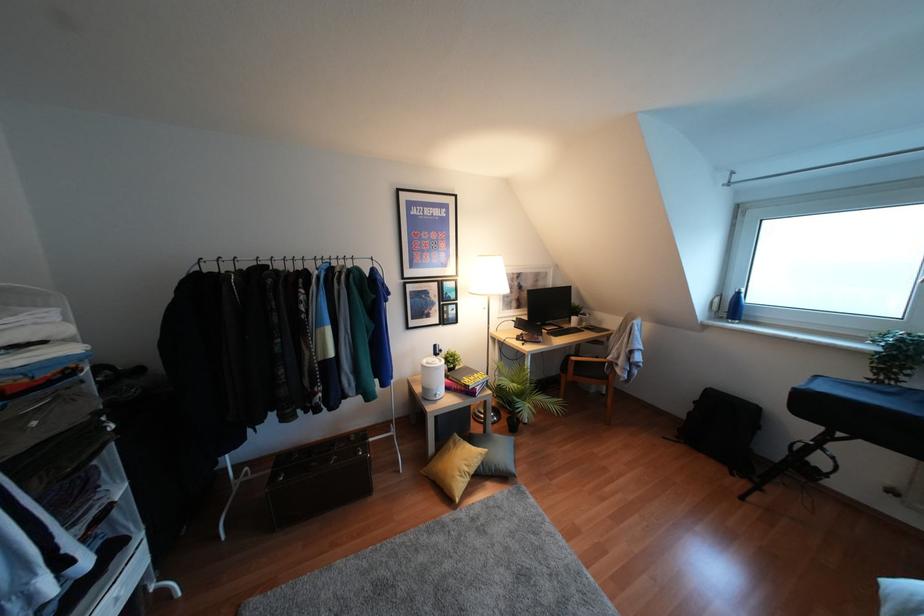
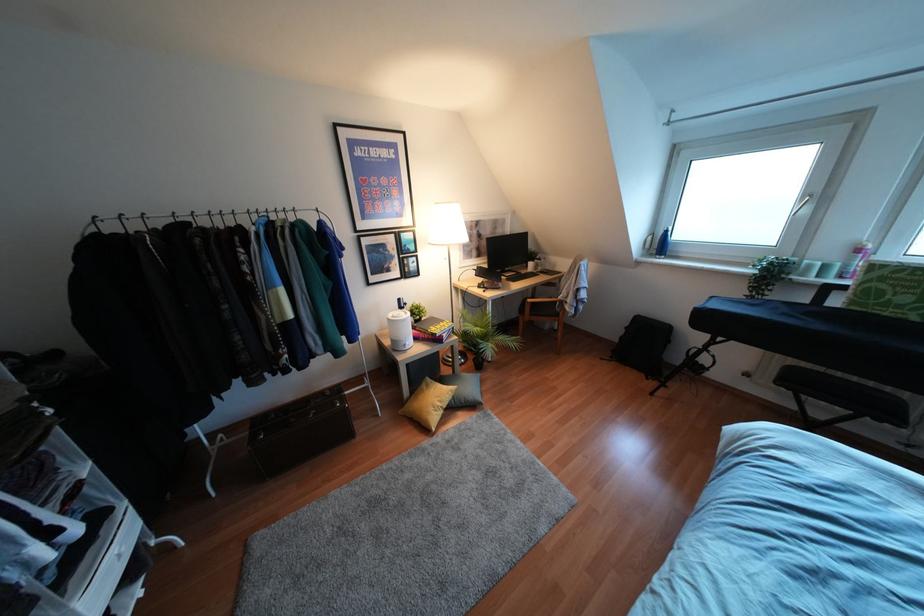
Find the pixel in the second image that matches (436,397) in the first image.

(407, 347)